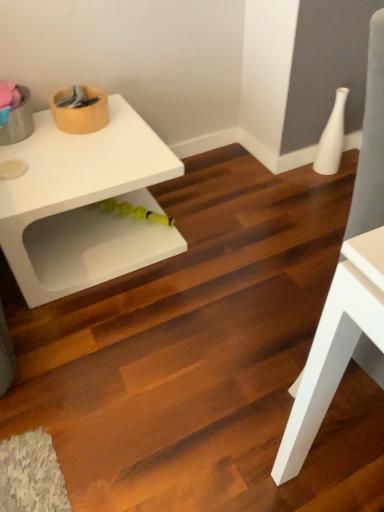
Question: Choose the correct answer: Is white matte table at upper left, positioned as the 1th table in back-to-front order, inside white glossy vase at upper right or outside it?

Choices:
 (A) outside
 (B) inside

Answer: (A)

Question: Looking at the image, does white matte table at upper left, which is the second table from right to left, seem bigger or smaller compared to white glossy vase at upper right?

Choices:
 (A) small
 (B) big

Answer: (B)

Question: Considering the real-world distances, which object is closest to the white matte table at right, which ranks as the first table in right-to-left order?

Choices:
 (A) white glossy vase at upper right
 (B) white matte table at upper left, which is the 1th table in left-to-right order

Answer: (B)

Question: Which object is positioned closest to the white matte table at upper left, positioned as the 1th table in back-to-front order?

Choices:
 (A) white glossy vase at upper right
 (B) white matte table at right, which ranks as the first table in right-to-left order

Answer: (B)